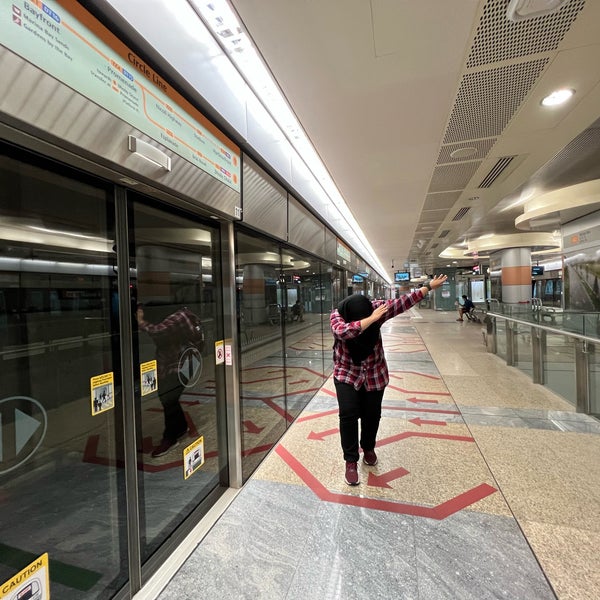
Locate an element on the screen. The width and height of the screenshot is (600, 600). ceiling is located at coordinates (353, 132).